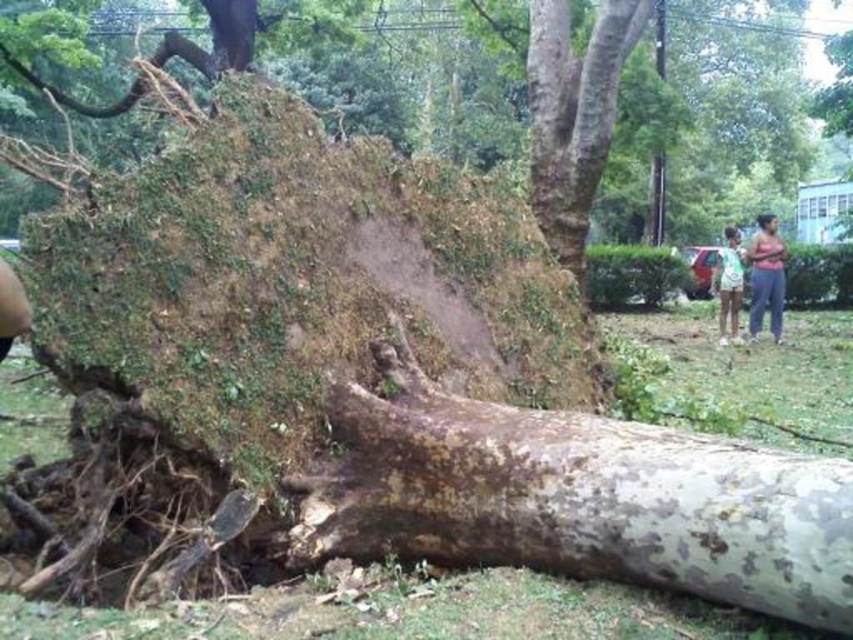
Question: Can you confirm if speckled bark tree trunk at center is bigger than green fabric shirt at right?

Choices:
 (A) no
 (B) yes

Answer: (A)

Question: Among these points, which one is farthest from the camera?

Choices:
 (A) (561, 35)
 (B) (718, 340)
 (C) (389, 465)

Answer: (B)

Question: Does speckled bark tree trunk at center have a lesser width compared to brown rough bark tree trunk at upper center?

Choices:
 (A) yes
 (B) no

Answer: (B)

Question: Which of the following is the farthest from the observer?

Choices:
 (A) speckled bark tree trunk at center
 (B) pink fabric shirt at right
 (C) brown rough bark tree trunk at upper center
 (D) green fabric shirt at right

Answer: (B)

Question: Can you confirm if speckled bark tree trunk at center is positioned to the left of pink fabric shirt at right?

Choices:
 (A) yes
 (B) no

Answer: (A)

Question: Estimate the real-world distances between objects in this image. Which object is farther from the brown rough bark tree trunk at upper center?

Choices:
 (A) green fabric shirt at right
 (B) pink fabric shirt at right
 (C) speckled bark tree trunk at center

Answer: (B)